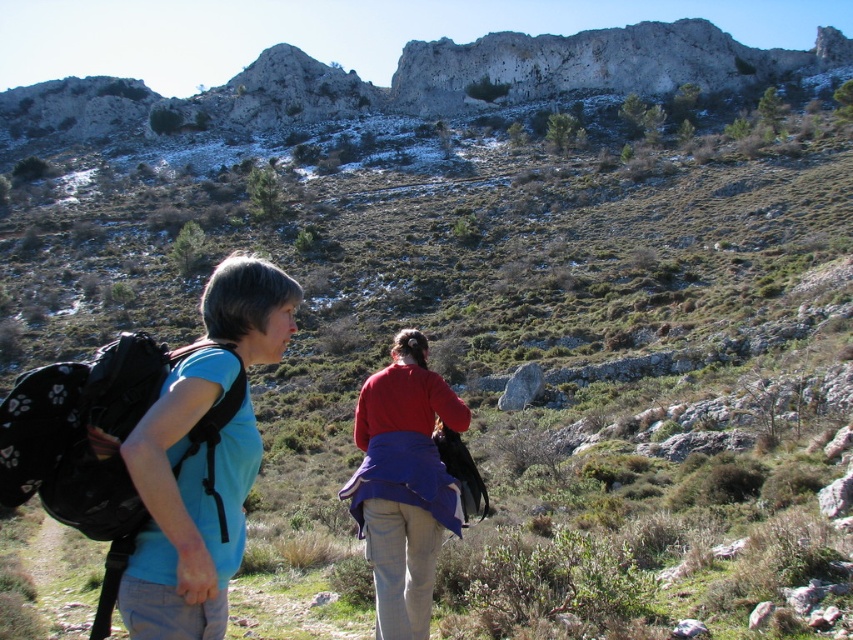
How distant is blue fabric backpack at left from black fabric backpack at left?

blue fabric backpack at left is 2.99 meters away from black fabric backpack at left.

Is point (202, 394) positioned in front of point (131, 531)?

No, it is behind (131, 531).

Who is more forward, (241,262) or (76,371)?

Point (76,371) is in front.

You are a GUI agent. You are given a task and a screenshot of the screen. Output one action in this format:
    pyautogui.click(x=<x>, y=<y>)
    Task: Click on the blue fabric backpack at left
    Image resolution: width=853 pixels, height=640 pixels.
    Given the screenshot: What is the action you would take?
    pyautogui.click(x=201, y=460)

Is black fabric backpack at left behind matte red sweater at center?

No, black fabric backpack at left is closer to the viewer.

Between black fabric backpack at left and matte red sweater at center, which one has more height?

With more height is black fabric backpack at left.

Who is more forward, (x=106, y=422) or (x=350, y=506)?

Positioned in front is point (x=106, y=422).

This screenshot has height=640, width=853. I want to click on black fabric backpack at left, so click(x=99, y=444).

Between blue fabric backpack at left and matte red sweater at center, which one is positioned lower?

matte red sweater at center

This screenshot has height=640, width=853. Identify the location of blue fabric backpack at left. (201, 460).